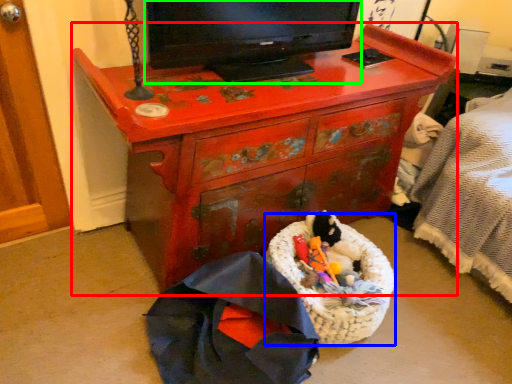
Question: Considering the real-world distances, which object is farthest from chest of drawers (highlighted by a red box)? laundry basket (highlighted by a blue box) or television (highlighted by a green box)?

Choices:
 (A) laundry basket
 (B) television

Answer: (A)